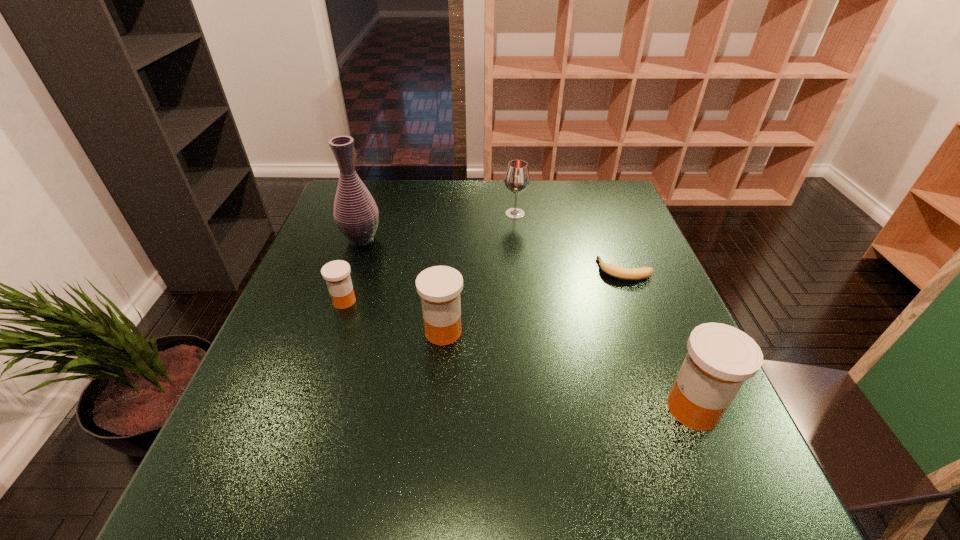
The height and width of the screenshot is (540, 960). Find the location of `free space between the shortest object and the wineglass`. free space between the shortest object and the wineglass is located at coordinates (570, 242).

Locate an element on the screen. empty space that is in between the fourth object from left to right and the rightmost medicine is located at coordinates (604, 311).

The height and width of the screenshot is (540, 960). I want to click on unoccupied position between the wineglass and the fifth nearest object, so click(439, 226).

Identify the location of vacant space that's between the leftmost medicine and the farthest object. This screenshot has width=960, height=540. (430, 258).

The height and width of the screenshot is (540, 960). I want to click on free space between the wineglass and the leftmost medicine, so click(x=430, y=258).

The image size is (960, 540). What are the coordinates of `free space between the rightmost medicine and the third object from left to right` in the screenshot? It's located at (568, 370).

This screenshot has height=540, width=960. I want to click on free point between the nearest medicine and the vase, so click(527, 323).

Identify the location of free space between the third farthest object and the third object from left to right. (535, 301).

You are a GUI agent. You are given a task and a screenshot of the screen. Output one action in this format:
    pyautogui.click(x=<x>, y=<y>)
    Task: Click on the unoccupied position between the fourth object from right to left and the fourth object from left to right
    
    Given the screenshot: What is the action you would take?
    pyautogui.click(x=479, y=273)

Find the location of a particular element. Image resolution: width=960 pixels, height=540 pixels. object that is the second closest to the fourth object from left to right is located at coordinates (356, 214).